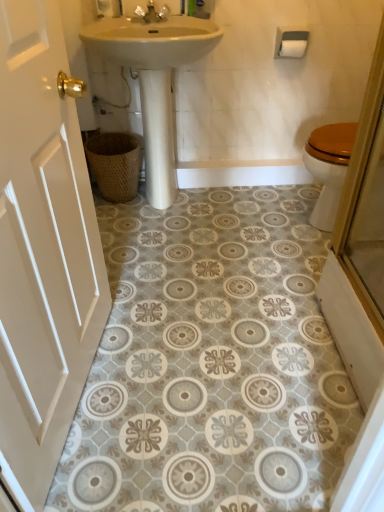
I want to click on blank space situated above woven brown basket at lower left (from a real-world perspective), so click(104, 141).